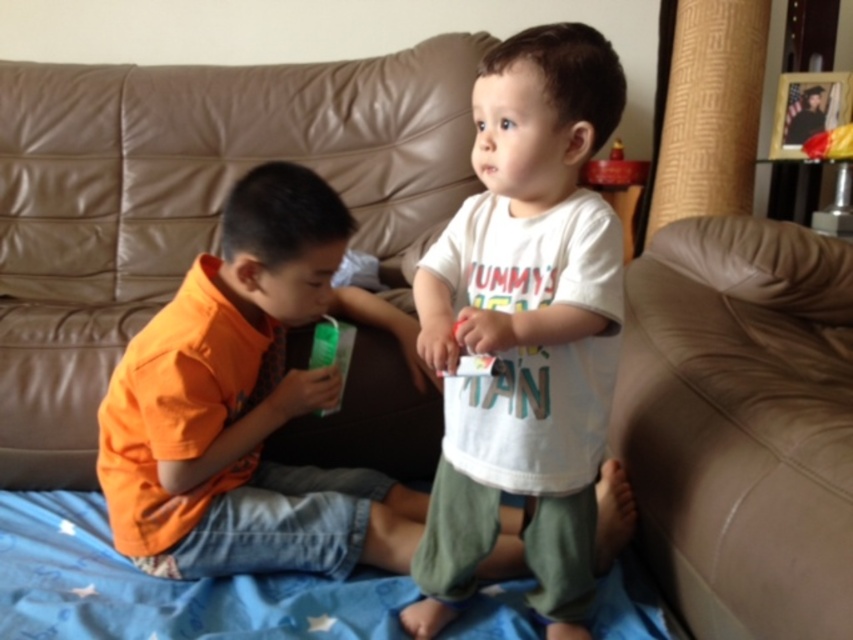
Question: Does brown leather couch at center appear on the left side of white cotton shirt at center?

Choices:
 (A) yes
 (B) no

Answer: (A)

Question: Estimate the real-world distances between objects in this image. Which object is farther from the brown leather couch at center?

Choices:
 (A) leather couch at lower right
 (B) white cotton shirt at center
 (C) orange cotton shirt at center
 (D) green plastic bottle at center

Answer: (A)

Question: Among these objects, which one is nearest to the camera?

Choices:
 (A) brown leather couch at center
 (B) orange cotton shirt at center
 (C) white cotton shirt at center
 (D) leather couch at lower right

Answer: (D)

Question: Which point is farther from the camera taking this photo?

Choices:
 (A) (207, 106)
 (B) (532, 298)

Answer: (A)

Question: Can you confirm if brown leather couch at center is thinner than orange cotton shirt at center?

Choices:
 (A) yes
 (B) no

Answer: (B)

Question: Considering the relative positions of brown leather couch at center and white cotton shirt at center in the image provided, where is brown leather couch at center located with respect to white cotton shirt at center?

Choices:
 (A) left
 (B) right

Answer: (A)